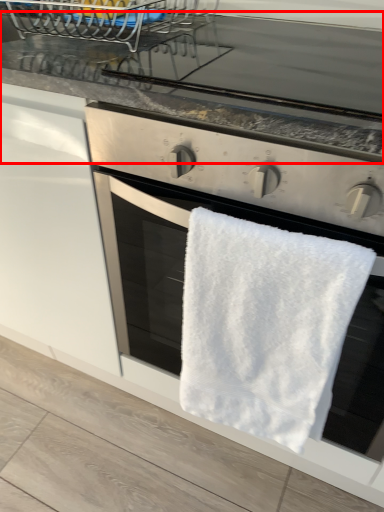
Question: From the image's perspective, what is the correct spatial relationship of countertop (annotated by the red box) in relation to towel/napkin?

Choices:
 (A) above
 (B) below

Answer: (A)